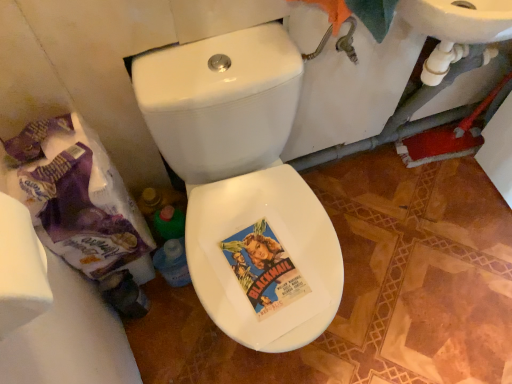
I want to click on free spot above white glossy bidet at center (from a real-world perspective), so click(x=267, y=270).